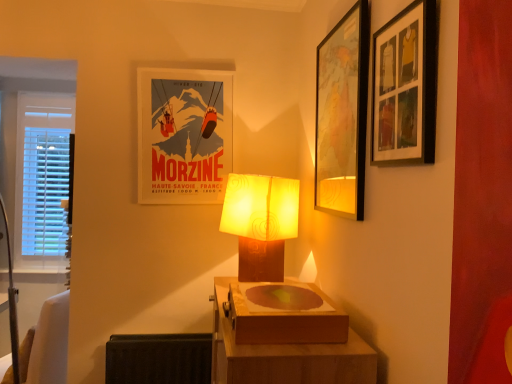
Question: Is matte brown lamp at center far from wooden table at center?

Choices:
 (A) no
 (B) yes

Answer: (A)

Question: Is matte brown lamp at center positioned behind wooden table at center?

Choices:
 (A) no
 (B) yes

Answer: (B)

Question: Is wooden table at center completely or partially inside matte brown lamp at center?

Choices:
 (A) yes
 (B) no

Answer: (B)

Question: Is matte brown lamp at center positioned beyond the bounds of wooden table at center?

Choices:
 (A) yes
 (B) no

Answer: (A)

Question: Considering the relative sizes of matte brown lamp at center and wooden table at center in the image provided, is matte brown lamp at center thinner than wooden table at center?

Choices:
 (A) yes
 (B) no

Answer: (A)

Question: Considering the positions of point (202, 74) and point (392, 52), is point (202, 74) closer or farther from the camera than point (392, 52)?

Choices:
 (A) closer
 (B) farther

Answer: (B)

Question: From a real-world perspective, is matte paper poster at center, which appears as the 1th picture frame when viewed from the back, positioned above or below wooden picture frame at upper right, which appears as the 1th picture frame when viewed from the right?

Choices:
 (A) below
 (B) above

Answer: (A)

Question: Is matte paper poster at center, which appears as the 1th picture frame when viewed from the back, wider or thinner than wooden picture frame at upper right, which appears as the 1th picture frame when viewed from the right?

Choices:
 (A) thin
 (B) wide

Answer: (A)

Question: Looking at the image, does matte paper poster at center, which appears as the 1th picture frame when viewed from the back, seem bigger or smaller compared to wooden picture frame at upper right, acting as the third picture frame starting from the left?

Choices:
 (A) small
 (B) big

Answer: (B)

Question: From a real-world perspective, is matte paper poster at center, arranged as the third picture frame when viewed from the right, physically located above or below matte brown lamp at center?

Choices:
 (A) above
 (B) below

Answer: (A)

Question: In terms of width, does matte paper poster at center, which appears as the 1th picture frame when viewed from the back, look wider or thinner when compared to matte brown lamp at center?

Choices:
 (A) wide
 (B) thin

Answer: (B)

Question: Is matte paper poster at center, the third picture frame in the front-to-back sequence, taller or shorter than matte brown lamp at center?

Choices:
 (A) tall
 (B) short

Answer: (A)

Question: From the image's perspective, relative to matte brown lamp at center, is matte paper poster at center, the third picture frame in the front-to-back sequence, above or below?

Choices:
 (A) above
 (B) below

Answer: (A)

Question: From a real-world perspective, is matte brown lamp at center positioned above or below wooden picture frame at upper right, the 1th picture frame viewed from the front?

Choices:
 (A) below
 (B) above

Answer: (A)

Question: Considering the positions of matte brown lamp at center and wooden picture frame at upper right, the 1th picture frame viewed from the front, in the image, is matte brown lamp at center bigger or smaller than wooden picture frame at upper right, the 1th picture frame viewed from the front,?

Choices:
 (A) small
 (B) big

Answer: (B)